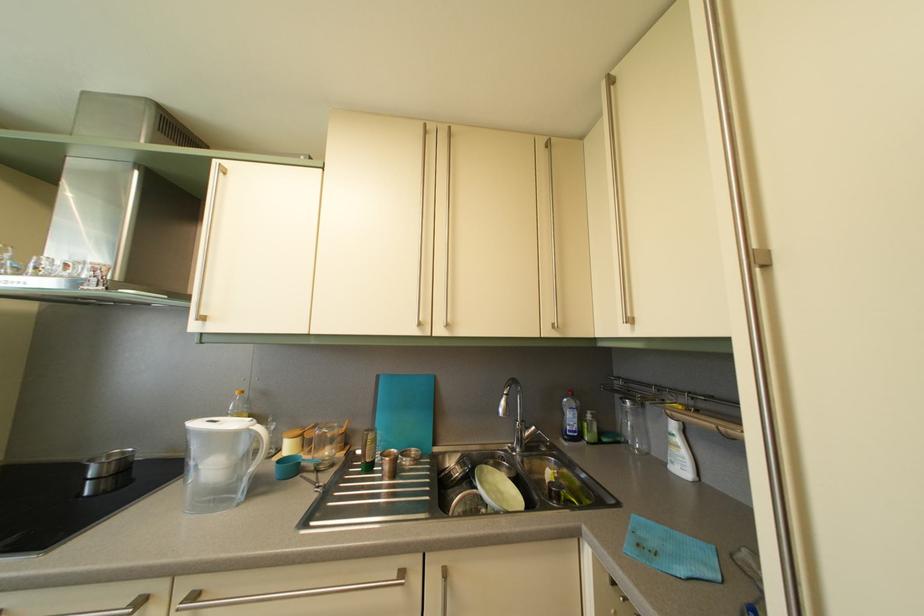
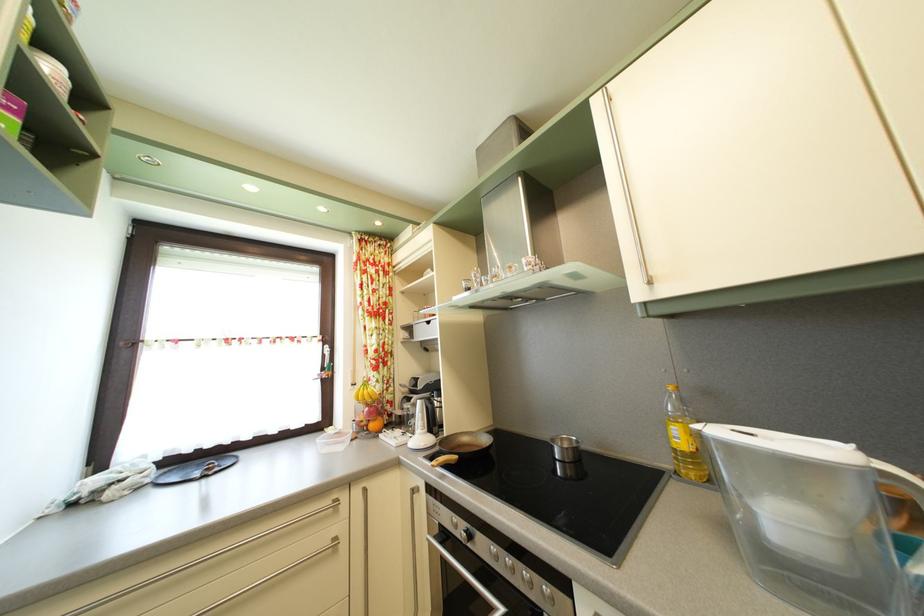
Where in the second image is the point corresponding to [273,400] from the first image?

(715, 400)